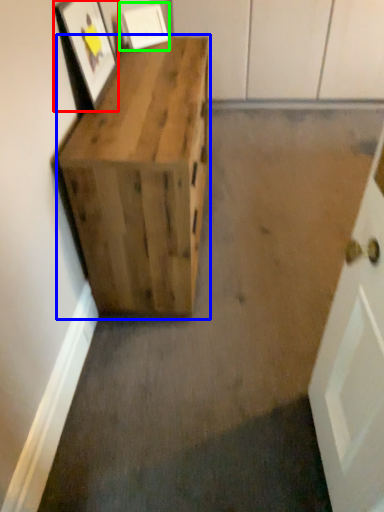
Question: Which is nearer to the picture frame (highlighted by a red box)? furniture (highlighted by a blue box) or picture frame (highlighted by a green box).

Choices:
 (A) furniture
 (B) picture frame

Answer: (A)